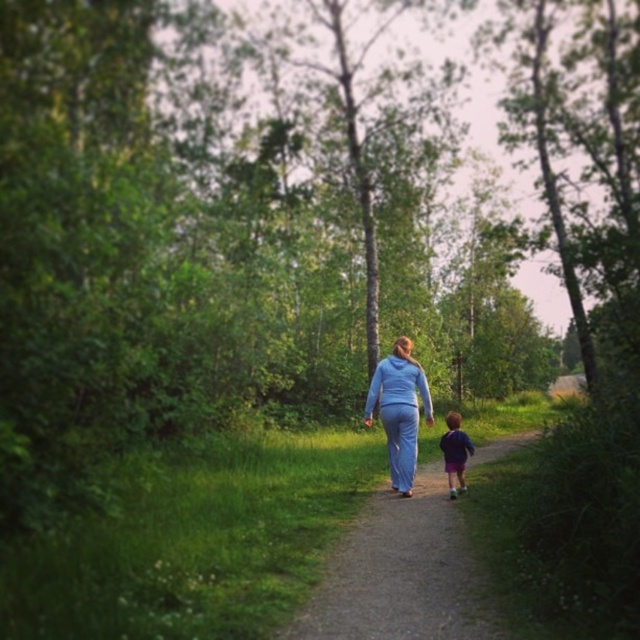
You are standing at the edge of the dirt path at center and want to greet the purple fabric boy at lower right. In which direction should you walk to reach him?

You should walk to the right because the dirt path at center is to the left of purple fabric boy at lower right, so moving right along the path will lead you towards him.

You are a hiker planning to walk on the dirt path at center while wearing the blue fabric pants at center. Considering the size of the path, will you have enough space to walk comfortably without stepping off the path?

The dirt path at center is bigger than the blue fabric pants at center, so yes, there should be enough space to walk comfortably without stepping off the path.

You are standing at the point marked by the coordinates point (400, 410) in the image. What object is located exactly at that point?

The point (400, 410) corresponds to the blue fabric pants at center.